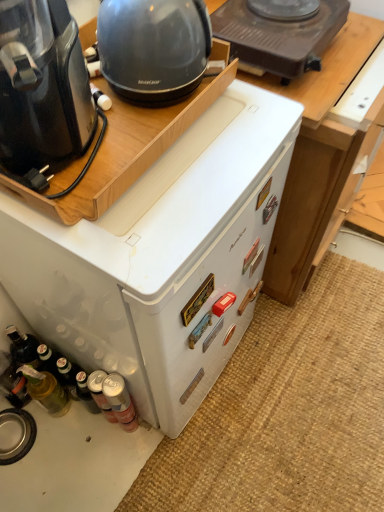
Question: Is black plastic coffee maker at left, arranged as the 1th home appliance when viewed from the front, completely or partially inside metallic silver can at lower left, which is the second bottle from right to left?

Choices:
 (A) no
 (B) yes

Answer: (A)

Question: Considering the relative sizes of metallic silver can at lower left, arranged as the 2th bottle when viewed from the left, and black plastic coffee maker at left, marked as the second home appliance in a back-to-front arrangement, in the image provided, is metallic silver can at lower left, arranged as the 2th bottle when viewed from the left, taller than black plastic coffee maker at left, marked as the second home appliance in a back-to-front arrangement,?

Choices:
 (A) yes
 (B) no

Answer: (A)

Question: Can you confirm if metallic silver can at lower left, arranged as the 2th bottle when viewed from the left, is shorter than black plastic coffee maker at left, marked as the second home appliance in a back-to-front arrangement?

Choices:
 (A) yes
 (B) no

Answer: (B)

Question: From the image's perspective, is metallic silver can at lower left, which is the second bottle from right to left, beneath black plastic coffee maker at left, arranged as the 1th home appliance when viewed from the front?

Choices:
 (A) yes
 (B) no

Answer: (A)

Question: From a real-world perspective, is metallic silver can at lower left, which is the second bottle from right to left, under black plastic coffee maker at left, marked as the second home appliance in a back-to-front arrangement?

Choices:
 (A) no
 (B) yes

Answer: (B)

Question: Considering the positions of white matte refrigerator at center, the 1th home appliance in the back-to-front sequence, and translucent glass bottle at lower left, acting as the first bottle starting from the left, in the image, is white matte refrigerator at center, the 1th home appliance in the back-to-front sequence, wider or thinner than translucent glass bottle at lower left, acting as the first bottle starting from the left,?

Choices:
 (A) thin
 (B) wide

Answer: (B)

Question: Is white matte refrigerator at center, the 1th home appliance in the back-to-front sequence, bigger or smaller than translucent glass bottle at lower left, which is the third bottle in right-to-left order?

Choices:
 (A) big
 (B) small

Answer: (A)

Question: Visually, is white matte refrigerator at center, positioned as the second home appliance in front-to-back order, positioned to the left or to the right of translucent glass bottle at lower left, which is the third bottle in right-to-left order?

Choices:
 (A) right
 (B) left

Answer: (A)

Question: In terms of height, does white matte refrigerator at center, positioned as the second home appliance in front-to-back order, look taller or shorter compared to translucent glass bottle at lower left, which is the third bottle in right-to-left order?

Choices:
 (A) short
 (B) tall

Answer: (B)

Question: Visually, is metallic silver can at lower left, the first bottle in the right-to-left sequence, positioned to the left or to the right of brown plastic stove at upper center?

Choices:
 (A) right
 (B) left

Answer: (B)

Question: Considering the positions of metallic silver can at lower left, the first bottle in the right-to-left sequence, and brown plastic stove at upper center in the image, is metallic silver can at lower left, the first bottle in the right-to-left sequence, taller or shorter than brown plastic stove at upper center?

Choices:
 (A) tall
 (B) short

Answer: (A)

Question: Is metallic silver can at lower left, the 3th bottle viewed from the left, in front of or behind brown plastic stove at upper center in the image?

Choices:
 (A) front
 (B) behind

Answer: (B)

Question: In terms of size, does metallic silver can at lower left, the 3th bottle viewed from the left, appear bigger or smaller than brown plastic stove at upper center?

Choices:
 (A) big
 (B) small

Answer: (B)

Question: Is point (240, 13) closer or farther from the camera than point (87, 381)?

Choices:
 (A) closer
 (B) farther

Answer: (A)

Question: From their relative heights in the image, would you say brown plastic stove at upper center is taller or shorter than metallic silver can at lower left, arranged as the 2th bottle when viewed from the left?

Choices:
 (A) short
 (B) tall

Answer: (A)